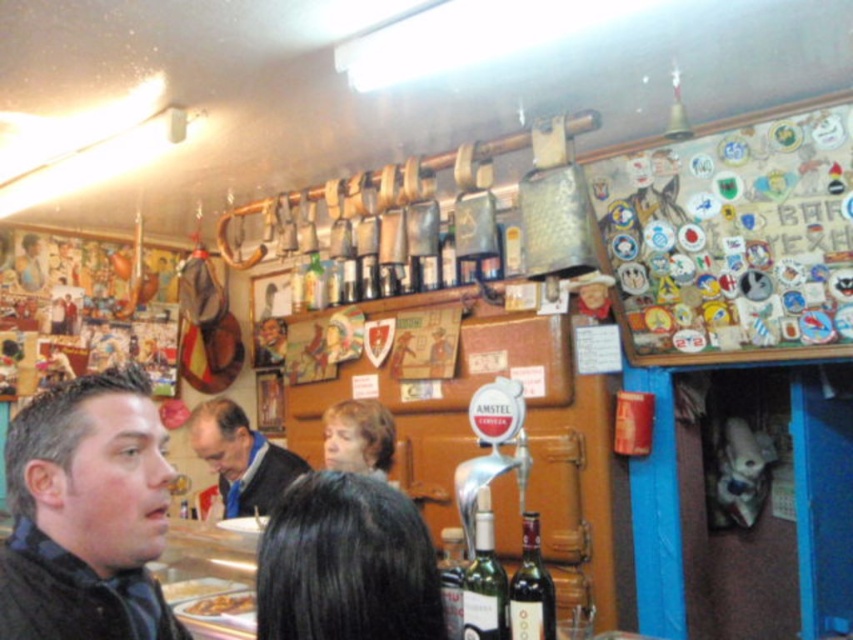
Question: Is black hair at center bigger than blue fabric shirt at center?

Choices:
 (A) yes
 (B) no

Answer: (B)

Question: Is wooden plaque with badges at upper right behind green glass bottle at center?

Choices:
 (A) yes
 (B) no

Answer: (A)

Question: Which is farther from the translucent glass wine bottle at center?

Choices:
 (A) green glass bottle at center
 (B) light brown hair at center

Answer: (B)

Question: Which point is closer to the camera taking this photo?

Choices:
 (A) (444, 564)
 (B) (552, 612)
 (C) (786, 108)
 (D) (316, 596)

Answer: (D)

Question: Which object appears closest to the camera in this image?

Choices:
 (A) black hair at center
 (B) green glass bottle at center
 (C) wooden plaque with badges at upper right

Answer: (A)

Question: Can you confirm if wooden plaque with badges at upper right is positioned below dark red glass bottle at center?

Choices:
 (A) yes
 (B) no

Answer: (B)